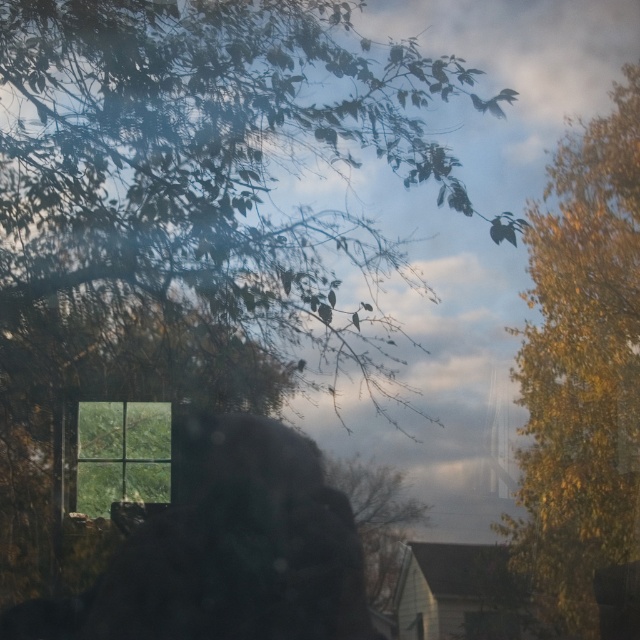
Is green leafy tree at upper left above silky black hair at center?

Yes, green leafy tree at upper left is above silky black hair at center.

Is point (269, 244) behind point (228, 465)?

Yes, point (269, 244) is behind point (228, 465).

Identify the location of green leafy tree at upper left. This screenshot has width=640, height=640. (209, 163).

Does silky black hair at center appear over green leafy tree at center?

No.

Which is more to the right, silky black hair at center or green leafy tree at center?

green leafy tree at center

At what (x,y) coordinates should I click in order to perform the action: click on silky black hair at center. Please return your answer as a coordinate pair (x, y). Image resolution: width=640 pixels, height=640 pixels. Looking at the image, I should click on (240, 547).

Which is more to the right, green leafy tree at upper left or green leafy tree at center?

Positioned to the right is green leafy tree at center.

Does green leafy tree at upper left appear on the left side of green leafy tree at center?

Indeed, green leafy tree at upper left is positioned on the left side of green leafy tree at center.

At what (x,y) coordinates should I click in order to perform the action: click on green leafy tree at upper left. Please return your answer as a coordinate pair (x, y). The image size is (640, 640). Looking at the image, I should click on [209, 163].